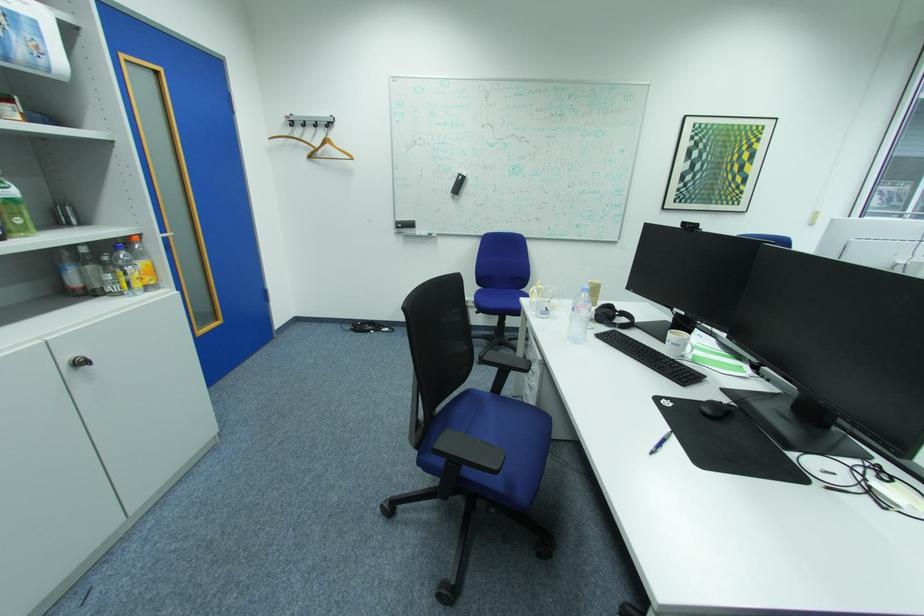
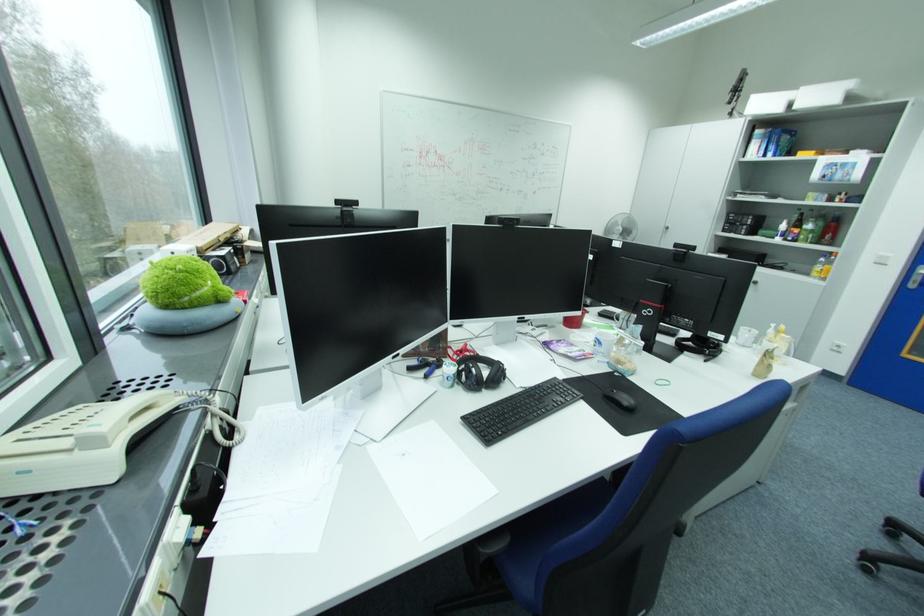
Locate, in the second image, the point that corresponds to pixel 91 363 in the first image.

(763, 283)